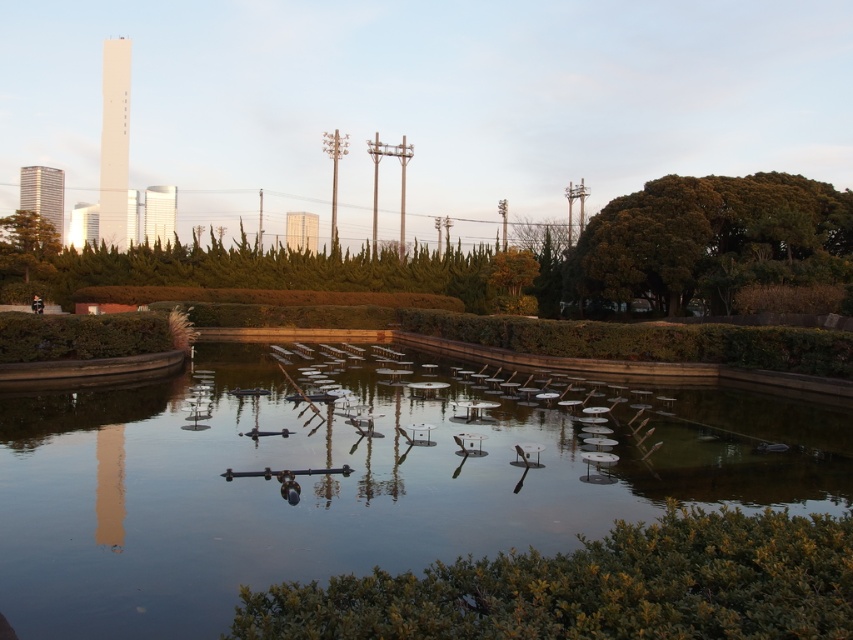
You are a visitor standing at the edge of the park and want to take a photo of both the transparent glass water at center and the green textured hedge at upper center. Based on their positions, which object should you focus on first to ensure both are in the frame?

Since the transparent glass water at center is located below the green textured hedge at upper center, you should focus on the green textured hedge at upper center first to ensure both are in the frame.

You are standing at the edge of the water in the urban park. There is a point marked at coordinates (354, 477). What is located at that point?

The point at coordinates (354, 477) marks transparent glass water at center.